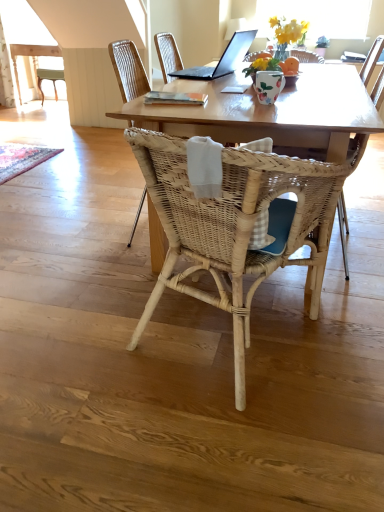
Find the location of `vacant space to the right of floral ceramic vase at upper center`. vacant space to the right of floral ceramic vase at upper center is located at coordinates (315, 99).